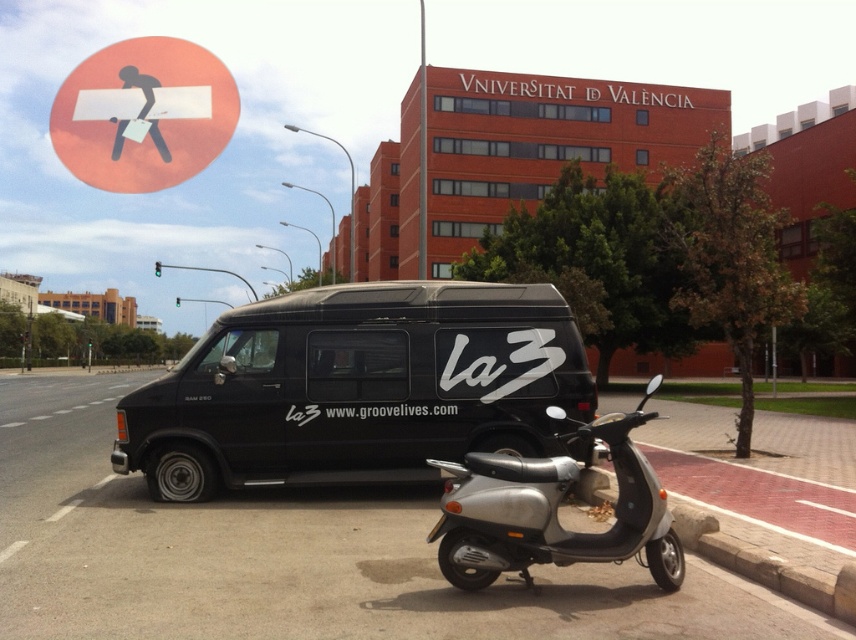
Can you confirm if black matte van at center is positioned to the right of orange matte sign at upper left?

Correct, you'll find black matte van at center to the right of orange matte sign at upper left.

Which is more to the left, black matte van at center or orange matte sign at upper left?

orange matte sign at upper left is more to the left.

The image size is (856, 640). In order to click on black matte van at center in this screenshot , I will do `click(358, 387)`.

Can you confirm if silver metallic scooter at center is thinner than orange matte sign at upper left?

Indeed, silver metallic scooter at center has a lesser width compared to orange matte sign at upper left.

Looking at this image, who is more forward, [655,518] or [153,150]?

Positioned in front is point [655,518].

Which is behind, point (492, 492) or point (230, 112)?

Positioned behind is point (230, 112).

Find the location of a particular element. This screenshot has width=856, height=640. silver metallic scooter at center is located at coordinates (553, 509).

The image size is (856, 640). What do you see at coordinates (358, 387) in the screenshot? I see `black matte van at center` at bounding box center [358, 387].

Is point (547, 337) behind point (538, 461)?

Yes, point (547, 337) is behind point (538, 461).

The height and width of the screenshot is (640, 856). I want to click on black matte van at center, so click(358, 387).